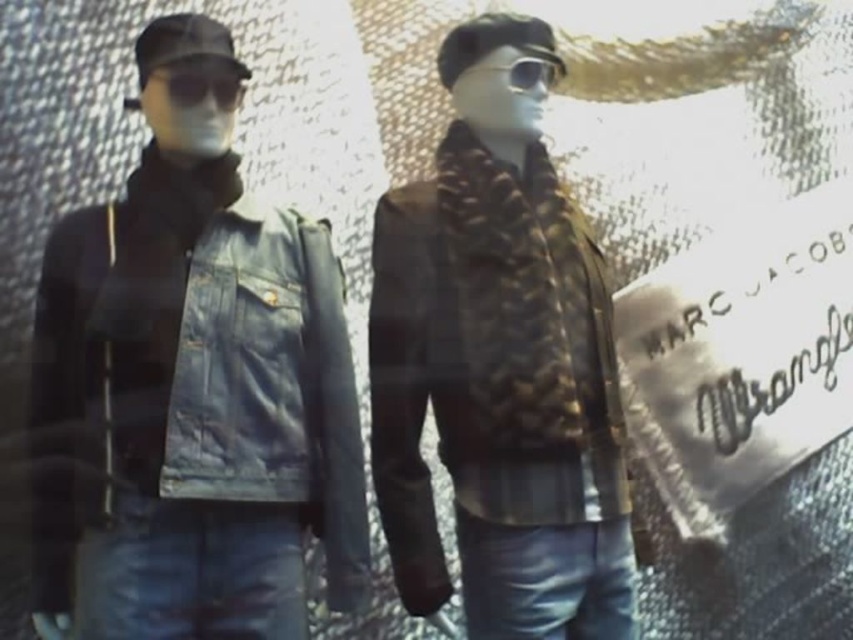
You are a fashion designer standing in front of the two mannequins. You need to place a new accessory exactly at the center of the leather jacket at center. Where should you place it?

The leather jacket at center should have the accessory placed at its exact center coordinates, which are at point 0.577 on the x and 0.586 on the y axis.

You are a fashion designer observing the two mannequins. You need to determine the spatial relationship between the leather jacket at center and the matte black goggles at left. Which object is positioned lower in the image?

The leather jacket at center is positioned lower than the matte black goggles at left.